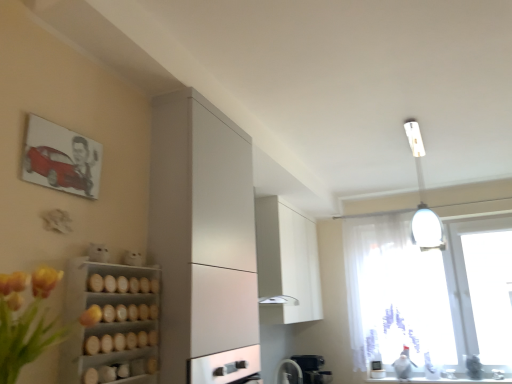
Question: Relative to white glossy fan at lower center, is wooden shelves at lower left in front or behind?

Choices:
 (A) front
 (B) behind

Answer: (A)

Question: Considering the relative positions of wooden shelves at lower left and white glossy fan at lower center in the image provided, is wooden shelves at lower left to the left or to the right of white glossy fan at lower center?

Choices:
 (A) right
 (B) left

Answer: (B)

Question: Estimate the real-world distances between objects in this image. Which object is farther from the white glossy counter top at lower right?

Choices:
 (A) white matte cabinet at upper center, which ranks as the first cabinetry in right-to-left order
 (B) wooden shelves at lower left
 (C) transparent fabric at right
 (D) yellow artificial flowers at left
 (E) white glossy light fixture at upper right

Answer: (D)

Question: Estimate the real-world distances between objects in this image. Which object is farther from the white glossy light fixture at upper right?

Choices:
 (A) yellow artificial flowers at left
 (B) satin black coffee machine at lower center
 (C) white glossy counter top at lower right
 (D) wooden shelves at lower left
 (E) satin white cabinet at left, the first cabinetry viewed from the front

Answer: (A)